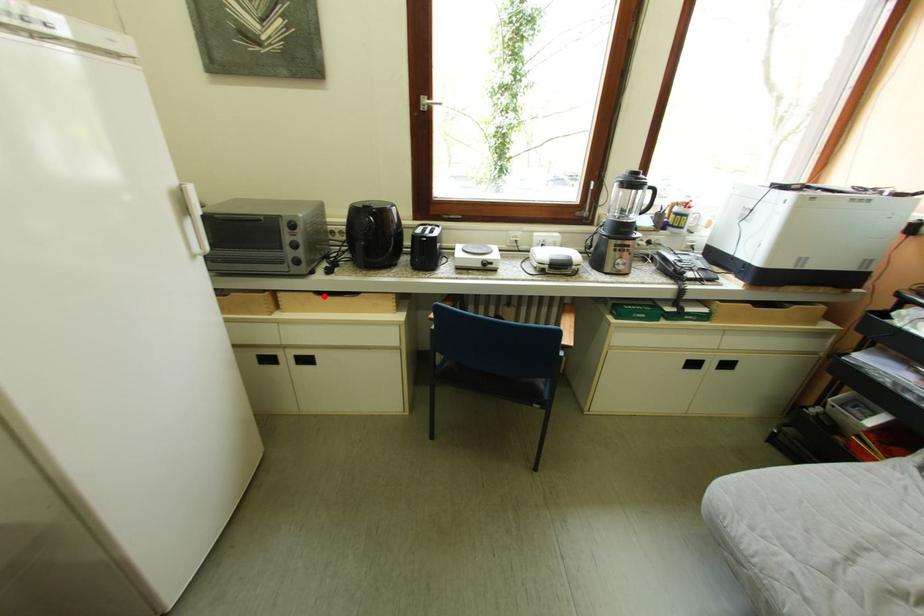
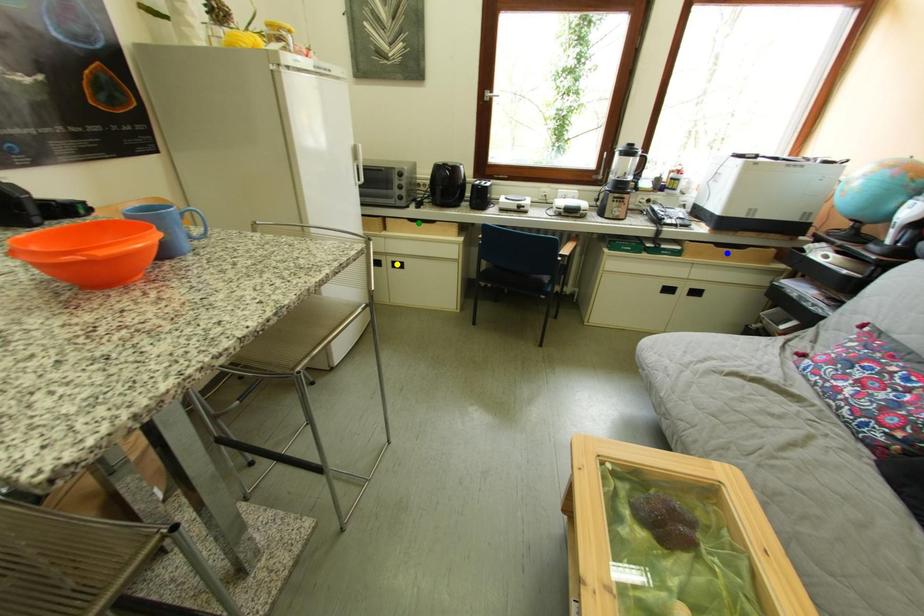
Question: I am providing you with two images of the same scene from different viewpoints. A red point is marked on the first image. You are given multiple points on the second image. Which point in image 2 is actually the same real-world point as the red point in image 1?

Choices:
 (A) yellow point
 (B) blue point
 (C) green point

Answer: (C)